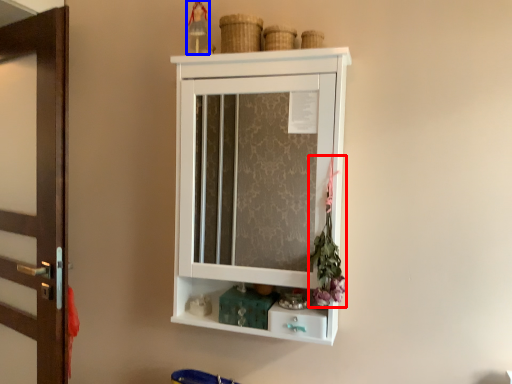
Question: Which object is closer to the camera taking this photo, flower (highlighted by a red box) or toy (highlighted by a blue box)?

Choices:
 (A) flower
 (B) toy

Answer: (A)